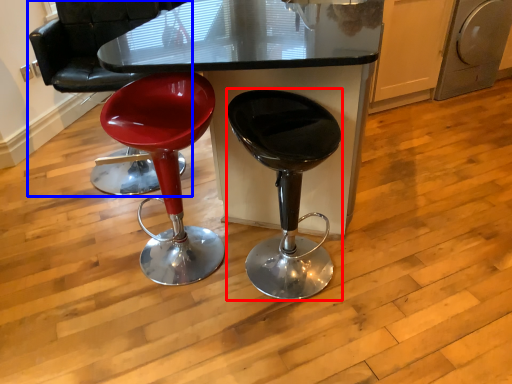
Question: Which point is closer to the camera, stool (highlighted by a red box) or chair (highlighted by a blue box)?

Choices:
 (A) stool
 (B) chair

Answer: (A)